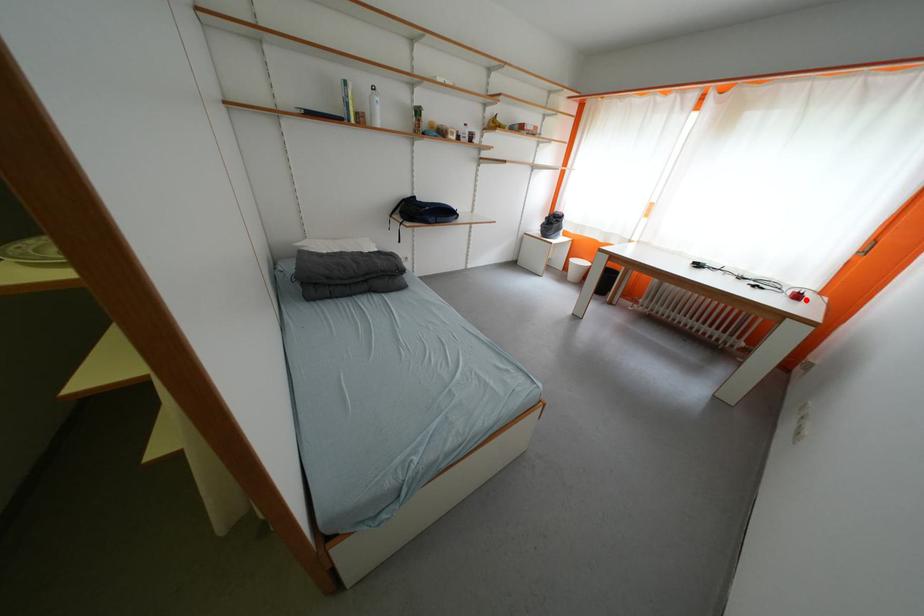
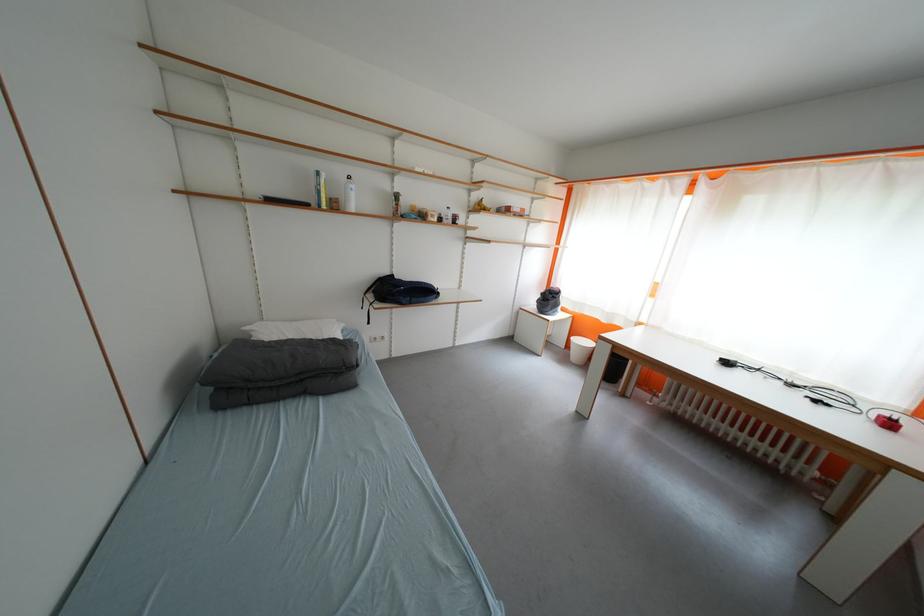
Question: A red point is marked in image1. In image2, is the corresponding 3D point closer to the camera or farther? Reply with the corresponding letter.

Choices:
 (A) The corresponding 3D point is closer.
 (B) The corresponding 3D point is farther.

Answer: (A)